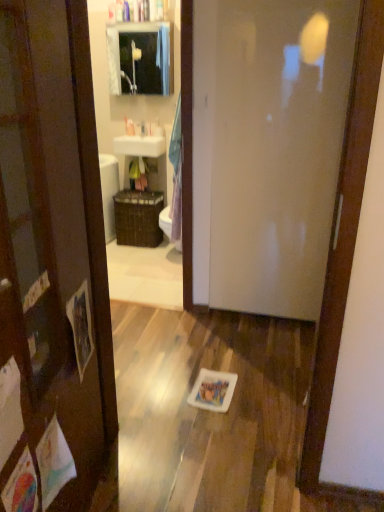
Question: Is white glossy door at center shorter than white glossy toilet at center?

Choices:
 (A) no
 (B) yes

Answer: (A)

Question: From the image's perspective, does white glossy door at center appear lower than white glossy toilet at center?

Choices:
 (A) yes
 (B) no

Answer: (B)

Question: Could you tell me if white glossy door at center is facing white glossy toilet at center?

Choices:
 (A) yes
 (B) no

Answer: (B)

Question: Can you confirm if white glossy door at center is bigger than white glossy toilet at center?

Choices:
 (A) no
 (B) yes

Answer: (B)

Question: Can we say white glossy door at center lies outside white glossy toilet at center?

Choices:
 (A) no
 (B) yes

Answer: (B)

Question: Is the depth of white glossy door at center less than that of white glossy toilet at center?

Choices:
 (A) yes
 (B) no

Answer: (A)

Question: From the image's perspective, is white glossy door at center above white plastic soap dispenser at upper center, the 2th toiletry when ordered from right to left?

Choices:
 (A) no
 (B) yes

Answer: (A)

Question: Is white glossy door at center placed right next to white plastic soap dispenser at upper center, the first toiletry positioned from the left?

Choices:
 (A) yes
 (B) no

Answer: (B)

Question: Does white glossy door at center have a larger size compared to white plastic soap dispenser at upper center, the first toiletry positioned from the left?

Choices:
 (A) no
 (B) yes

Answer: (B)

Question: Does white glossy door at center have a lesser height compared to white plastic soap dispenser at upper center, the 2th toiletry when ordered from right to left?

Choices:
 (A) yes
 (B) no

Answer: (B)

Question: Is the position of white glossy door at center less distant than that of white plastic soap dispenser at upper center, the 2th toiletry when ordered from right to left?

Choices:
 (A) no
 (B) yes

Answer: (B)

Question: From a real-world perspective, is white glossy door at center beneath white plastic soap dispenser at upper center, the 2th toiletry when ordered from right to left?

Choices:
 (A) no
 (B) yes

Answer: (B)

Question: Are white glossy toilet at center and brown woven basket at center making contact?

Choices:
 (A) no
 (B) yes

Answer: (A)